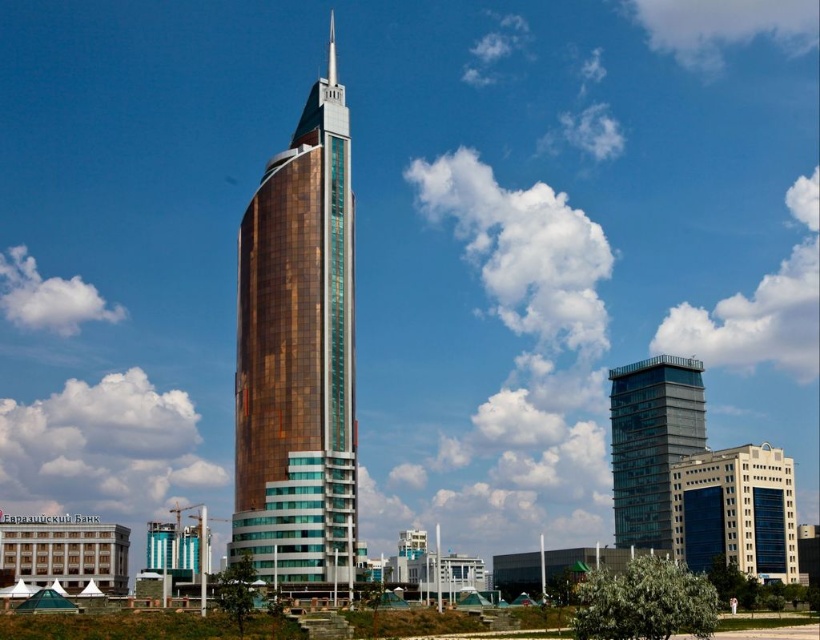
You are standing in the city square and looking at the skyscrapers. Which of the two buildings, the white glass building at lower right or the transparent glass building at center, is positioned to the right of the other?

The white glass building at lower right is positioned to the right of the transparent glass building at center.

You are an architect evaluating the urban layout. From your vantage point, which building is closer to you, the white glass building at lower right or the transparent glass building at center?

The white glass building at lower right is closer because it is in front of the transparent glass building at center.

You are standing at the point marked by coordinates point [298,355] in the image. What structure are you facing?

The point [298,355] corresponds to the gold reflective glass tower at center, so you are facing the gold reflective glass tower at center.